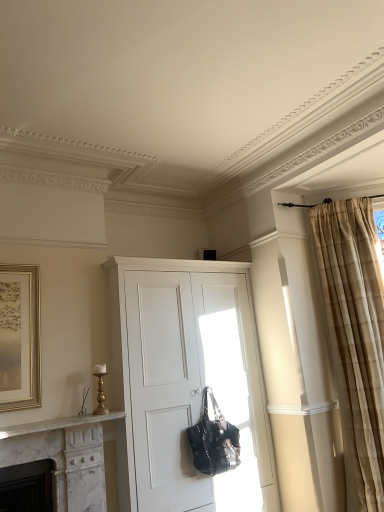
Question: Is black leather handbag at center at the left side of beige textured curtain at right?

Choices:
 (A) yes
 (B) no

Answer: (A)

Question: Considering the relative sizes of black leather handbag at center and beige textured curtain at right in the image provided, is black leather handbag at center wider than beige textured curtain at right?

Choices:
 (A) no
 (B) yes

Answer: (A)

Question: Is black leather handbag at center behind beige textured curtain at right?

Choices:
 (A) yes
 (B) no

Answer: (B)

Question: Considering the relative sizes of black leather handbag at center and beige textured curtain at right in the image provided, is black leather handbag at center smaller than beige textured curtain at right?

Choices:
 (A) yes
 (B) no

Answer: (A)

Question: Does black leather handbag at center have a greater height compared to beige textured curtain at right?

Choices:
 (A) yes
 (B) no

Answer: (B)

Question: From the image's perspective, is black leather handbag at center located beneath beige textured curtain at right?

Choices:
 (A) yes
 (B) no

Answer: (A)

Question: Could you tell me if black leather handbag at center is turned towards white matte cabinet at center?

Choices:
 (A) no
 (B) yes

Answer: (A)

Question: Is black leather handbag at center looking in the opposite direction of white matte cabinet at center?

Choices:
 (A) yes
 (B) no

Answer: (A)

Question: Considering the relative sizes of black leather handbag at center and white matte cabinet at center in the image provided, is black leather handbag at center wider than white matte cabinet at center?

Choices:
 (A) yes
 (B) no

Answer: (B)

Question: Can you confirm if black leather handbag at center is taller than white matte cabinet at center?

Choices:
 (A) yes
 (B) no

Answer: (B)

Question: Considering the relative positions of black leather handbag at center and white matte cabinet at center in the image provided, is black leather handbag at center in front of white matte cabinet at center?

Choices:
 (A) yes
 (B) no

Answer: (B)

Question: Can you confirm if black leather handbag at center is positioned to the left of white matte cabinet at center?

Choices:
 (A) no
 (B) yes

Answer: (A)

Question: Does beige textured curtain at right have a smaller size compared to white matte cabinet at center?

Choices:
 (A) yes
 (B) no

Answer: (A)